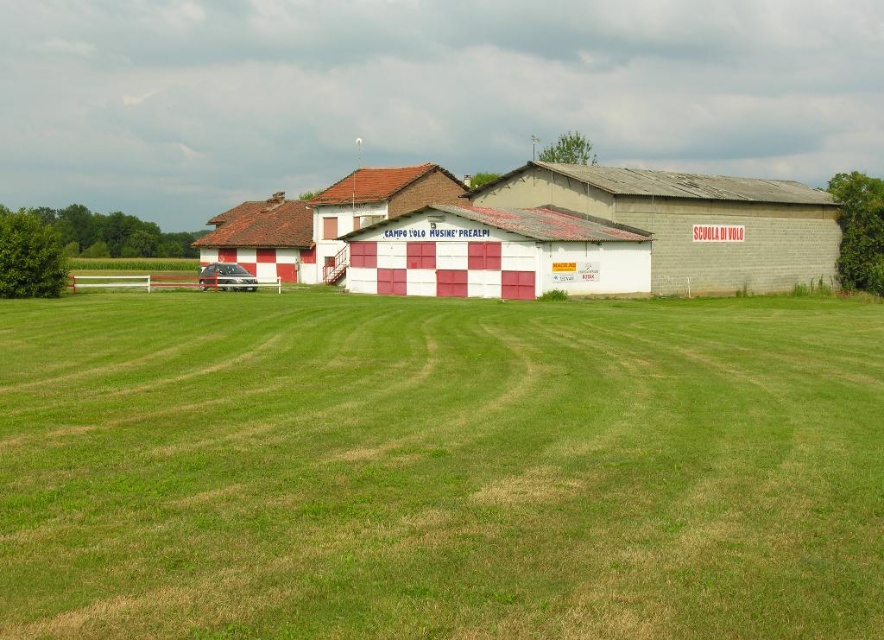
Is green grass at center smaller than checkerboard painted barn at center?

Yes.

Between green grass at center and checkerboard painted barn at center, which one has more height?

checkerboard painted barn at center

Where is `green grass at center`? Image resolution: width=884 pixels, height=640 pixels. green grass at center is located at coordinates (439, 467).

The image size is (884, 640). I want to click on green grass at center, so click(439, 467).

Between checkerboard painted barn at center and metallic silver car at center, which one appears on the left side from the viewer's perspective?

From the viewer's perspective, metallic silver car at center appears more on the left side.

Who is lower down, checkerboard painted barn at center or metallic silver car at center?

Positioned lower is metallic silver car at center.

Locate an element on the screen. This screenshot has width=884, height=640. checkerboard painted barn at center is located at coordinates (633, 218).

You are a GUI agent. You are given a task and a screenshot of the screen. Output one action in this format:
    pyautogui.click(x=<x>, y=<y>)
    Task: Click on the checkerboard painted barn at center
    The width and height of the screenshot is (884, 640).
    Given the screenshot: What is the action you would take?
    pyautogui.click(x=633, y=218)

Does green grass at center appear on the right side of metallic silver car at center?

Indeed, green grass at center is positioned on the right side of metallic silver car at center.

Can you confirm if green grass at center is thinner than metallic silver car at center?

In fact, green grass at center might be wider than metallic silver car at center.

Which is behind, point (386, 568) or point (237, 285)?

The point (237, 285) is behind.

Where is `green grass at center`? Image resolution: width=884 pixels, height=640 pixels. green grass at center is located at coordinates (439, 467).